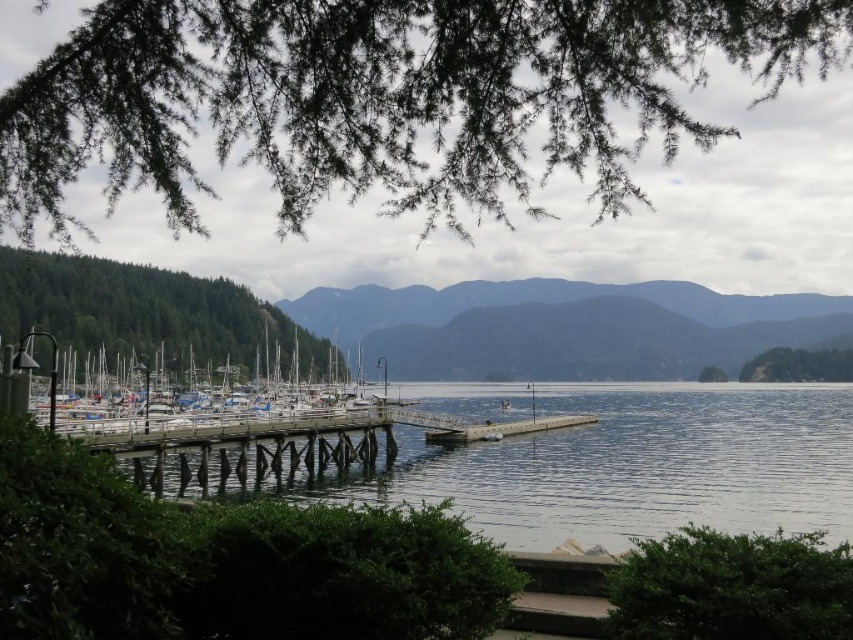
You are a photographer standing on the pathway and want to capture both the white matte boats at center and the green matte tree at center in a single shot. Which object should you position closer to the left side of your camera frame?

The white matte boats at center should be positioned closer to the left side of your camera frame since they are already located on the left side of the green matte tree at center in the scene.